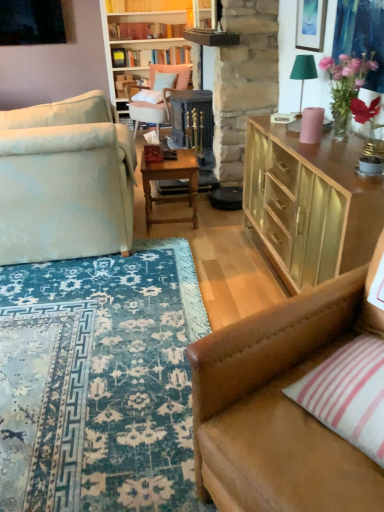
Question: From the image's perspective, is green fabric lampshade at upper right below white fabric pillow at center, which ranks as the 1th pillow in left-to-right order?

Choices:
 (A) no
 (B) yes

Answer: (B)

Question: Is green fabric lampshade at upper right oriented away from white fabric pillow at center, the 2th pillow positioned from the bottom?

Choices:
 (A) no
 (B) yes

Answer: (A)

Question: Is green fabric lampshade at upper right far from white fabric pillow at center, which ranks as the 1th pillow in left-to-right order?

Choices:
 (A) yes
 (B) no

Answer: (A)

Question: Does green fabric lampshade at upper right have a lesser width compared to white fabric pillow at center, which ranks as the 1th pillow in left-to-right order?

Choices:
 (A) no
 (B) yes

Answer: (B)

Question: Is green fabric lampshade at upper right positioned before white fabric pillow at center, which appears as the 1th pillow when viewed from the top?

Choices:
 (A) yes
 (B) no

Answer: (A)

Question: Does green fabric lampshade at upper right have a larger size compared to white fabric pillow at center, which ranks as the 1th pillow in left-to-right order?

Choices:
 (A) yes
 (B) no

Answer: (B)

Question: From a real-world perspective, is hardcover books at upper center, marked as the 2th book in a top-to-bottom arrangement, positioned under light beige fabric couch at left, the 2th studio couch viewed from the right, based on gravity?

Choices:
 (A) yes
 (B) no

Answer: (B)

Question: Does hardcover books at upper center, which ranks as the first book in back-to-front order, come behind light beige fabric couch at left, which is the first studio couch from left to right?

Choices:
 (A) no
 (B) yes

Answer: (B)

Question: Is hardcover books at upper center, the first book in the bottom-to-top sequence, not near light beige fabric couch at left, the 2th studio couch viewed from the right?

Choices:
 (A) no
 (B) yes

Answer: (B)

Question: Is the depth of hardcover books at upper center, the first book in the bottom-to-top sequence, less than that of light beige fabric couch at left, the second studio couch from the front?

Choices:
 (A) yes
 (B) no

Answer: (B)

Question: From a real-world perspective, is hardcover books at upper center, which ranks as the first book in back-to-front order, over light beige fabric couch at left, acting as the first studio couch starting from the back?

Choices:
 (A) no
 (B) yes

Answer: (B)

Question: Is hardcover books at upper center, the first book in the bottom-to-top sequence, facing towards light beige fabric couch at left, placed as the first studio couch when sorted from top to bottom?

Choices:
 (A) yes
 (B) no

Answer: (A)

Question: Can you confirm if brown leather couch at lower right, the second studio couch viewed from the left, is shorter than matte gold cabinet at upper right?

Choices:
 (A) no
 (B) yes

Answer: (A)